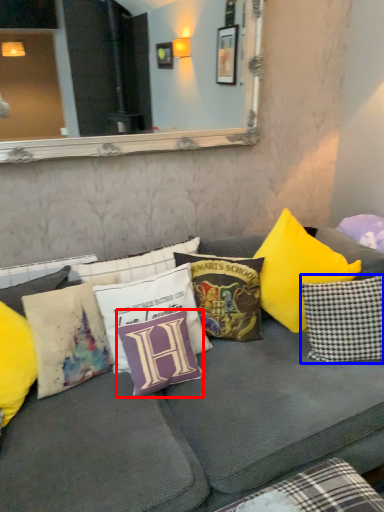
Question: Which object appears closest to the camera in this image, pillow (highlighted by a red box) or pillow (highlighted by a blue box)?

Choices:
 (A) pillow
 (B) pillow

Answer: (A)